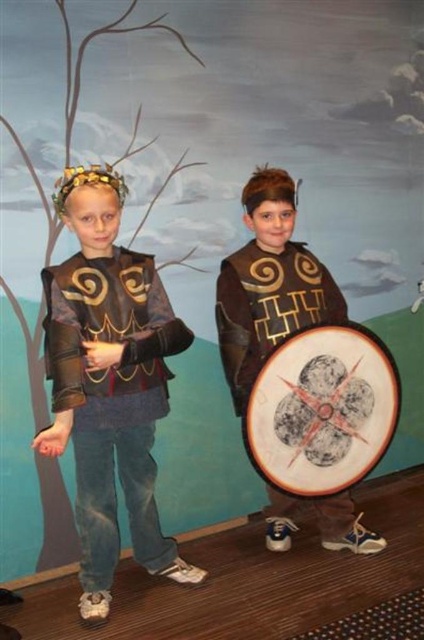
Question: Which point appears closest to the camera in this image?

Choices:
 (A) (337, 438)
 (B) (44, 296)
 (C) (331, 321)

Answer: (A)

Question: Can you confirm if matte black armor at left is positioned above wooden shield at right?

Choices:
 (A) yes
 (B) no

Answer: (A)

Question: Is matte black armor at left below wooden shield at right?

Choices:
 (A) no
 (B) yes

Answer: (A)

Question: Is matte black armor at left positioned behind brown leather shield at center?

Choices:
 (A) yes
 (B) no

Answer: (B)

Question: Estimate the real-world distances between objects in this image. Which object is farther from the wooden shield at right?

Choices:
 (A) matte black armor at left
 (B) brown leather shield at center

Answer: (A)

Question: Estimate the real-world distances between objects in this image. Which object is closer to the wooden shield at right?

Choices:
 (A) brown leather shield at center
 (B) matte black armor at left

Answer: (A)